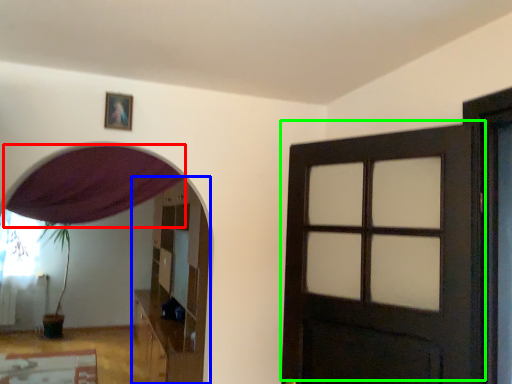
Question: Which object is positioned closest to curtain (highlighted by a red box)? Select from dresser (highlighted by a blue box) and door (highlighted by a green box).

Choices:
 (A) dresser
 (B) door

Answer: (B)